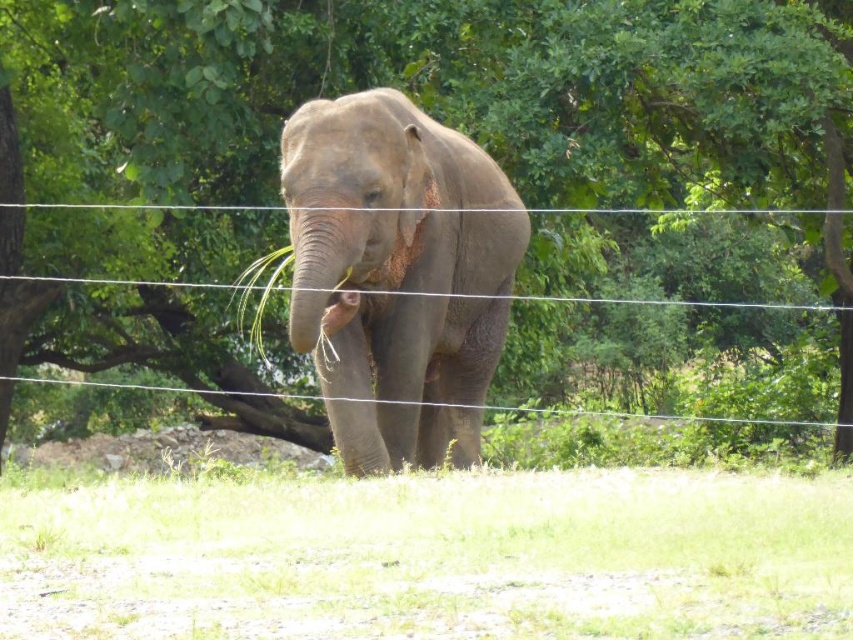
Question: Which point appears farthest from the camera in this image?

Choices:
 (A) (88, 99)
 (B) (424, 337)
 (C) (403, 602)

Answer: (A)

Question: Does green leafy tree at center have a larger size compared to gray matte elephant at center?

Choices:
 (A) yes
 (B) no

Answer: (A)

Question: Can you confirm if green leafy tree at center is bigger than green grass at lower center?

Choices:
 (A) yes
 (B) no

Answer: (A)

Question: Which of the following is the closest to the observer?

Choices:
 (A) gray matte elephant at center
 (B) green leafy tree at center

Answer: (A)

Question: Is green leafy tree at center wider than green grass at lower center?

Choices:
 (A) no
 (B) yes

Answer: (B)

Question: Which of the following is the closest to the observer?

Choices:
 (A) (311, 186)
 (B) (0, 499)
 (C) (543, 109)

Answer: (A)